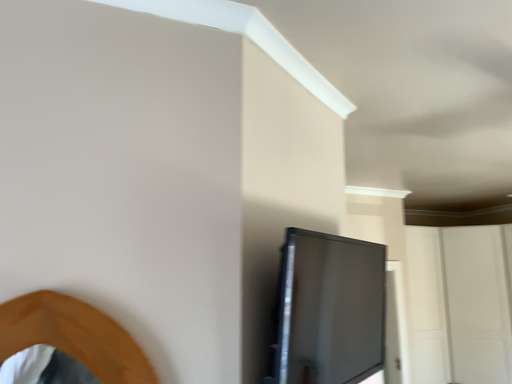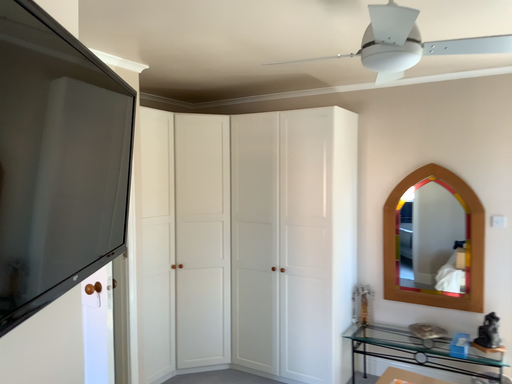
Question: Which way did the camera rotate in the video?

Choices:
 (A) rotated right
 (B) rotated left

Answer: (A)